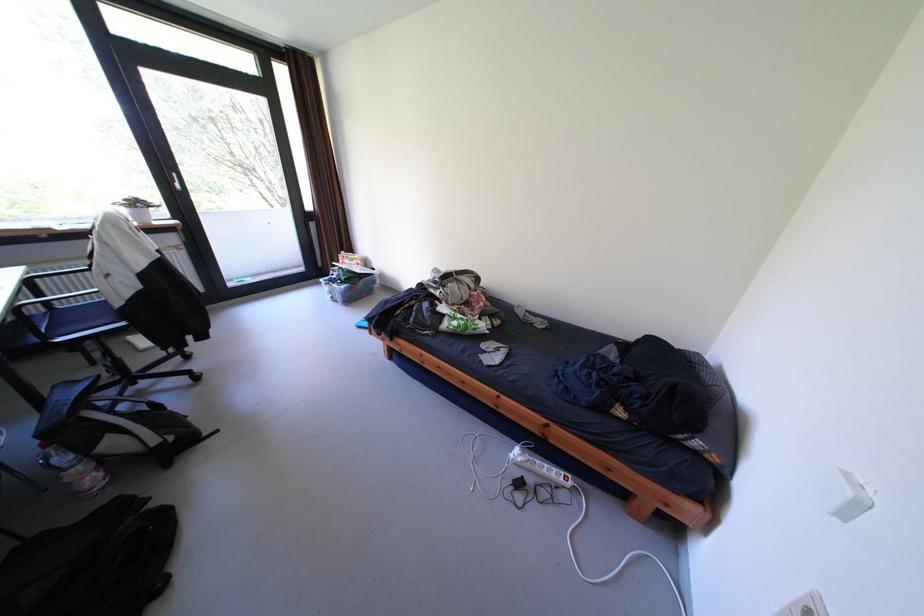
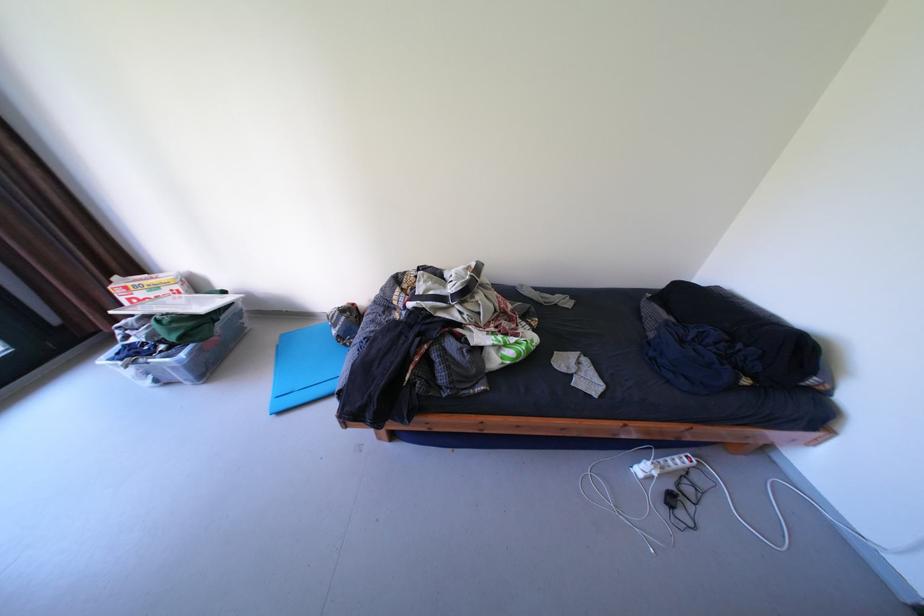
The point at (354, 286) is marked in the first image. Where is the corresponding point in the second image?

(193, 355)